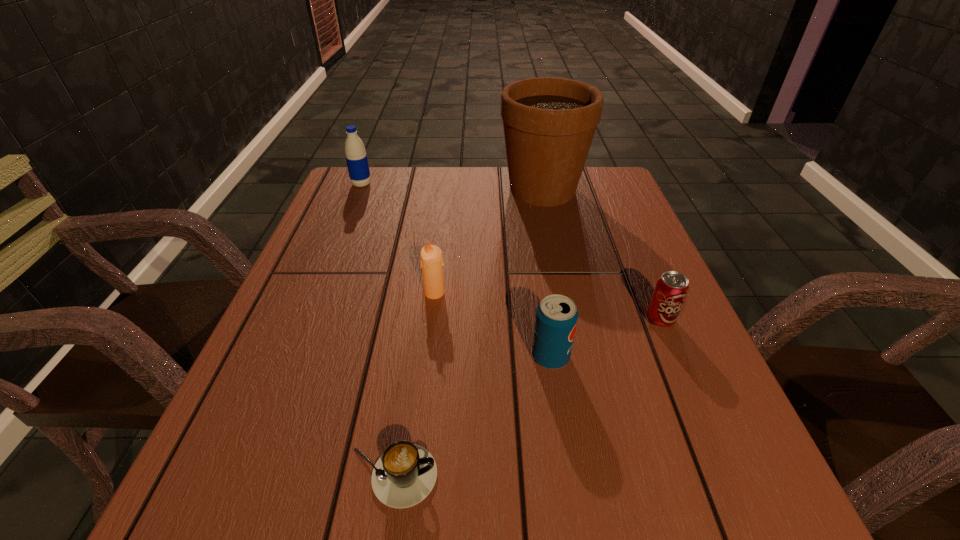
Locate an element on the screen. The image size is (960, 540). vacant region at the near right corner of the desktop is located at coordinates tap(654, 482).

This screenshot has width=960, height=540. What are the coordinates of `free space between the cappuccino and the rightmost object` in the screenshot? It's located at (526, 398).

This screenshot has width=960, height=540. In order to click on free space between the second tallest object and the second nearest object in this screenshot , I will do `click(456, 271)`.

Locate an element on the screen. The width and height of the screenshot is (960, 540). empty location between the right soda and the tallest object is located at coordinates (601, 255).

The width and height of the screenshot is (960, 540). Identify the location of free spot between the nearest object and the second nearest object. (471, 416).

I want to click on free space between the left soda and the third farthest object, so click(x=492, y=325).

You are a GUI agent. You are given a task and a screenshot of the screen. Output one action in this format:
    pyautogui.click(x=<x>, y=<y>)
    Task: Click on the vacant area between the second nearest object and the candle
    The width and height of the screenshot is (960, 540).
    Given the screenshot: What is the action you would take?
    pyautogui.click(x=492, y=325)

Find the location of a particular element. free spot between the left soda and the candle is located at coordinates (492, 325).

This screenshot has height=540, width=960. What are the coordinates of `vacant space that's between the nearer soda and the candle` in the screenshot? It's located at (492, 325).

Identify the location of blank region between the shortest object and the farther soda. (526, 398).